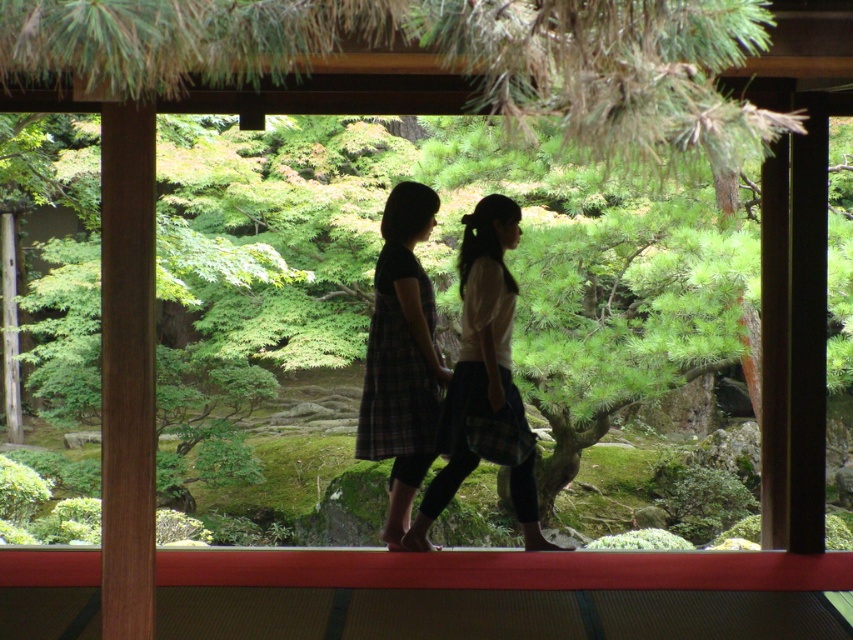
How far apart are silhouette plaid skirt at center and plaid fabric dress at center?

The distance of silhouette plaid skirt at center from plaid fabric dress at center is 12.36 inches.

Can you confirm if silhouette plaid skirt at center is wider than plaid fabric dress at center?

Yes.

Is point (432, 492) positioned before point (421, 282)?

No.

Identify the location of silhouette plaid skirt at center. The width and height of the screenshot is (853, 640). (485, 380).